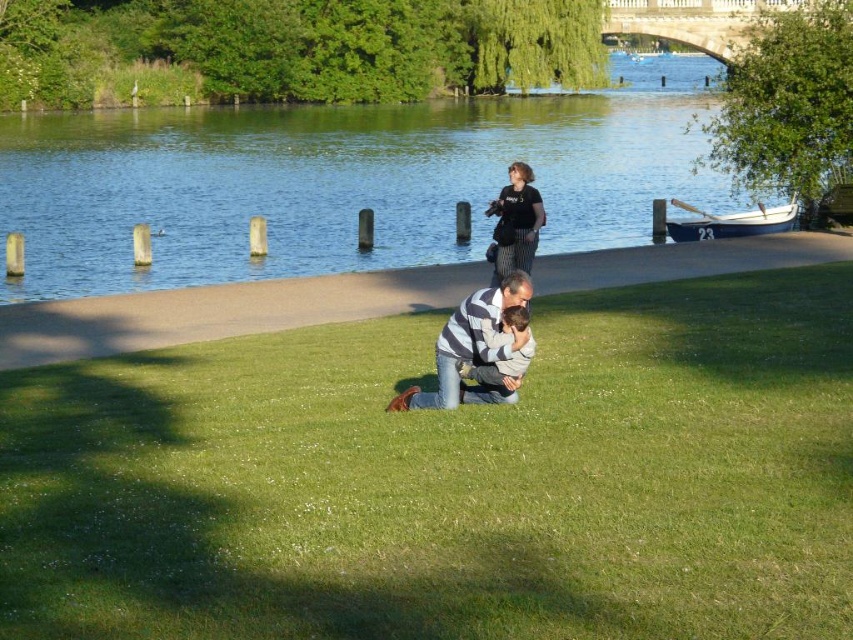
Question: Does striped knit sweater at center appear under striped fabric man at center?

Choices:
 (A) no
 (B) yes

Answer: (A)

Question: Based on their relative distances, which object is nearer to the striped fabric man at center?

Choices:
 (A) striped knit sweater at center
 (B) green grass at center
 (C) green water at upper center

Answer: (A)

Question: Does green grass at center appear on the left side of black cotton shirt at center?

Choices:
 (A) no
 (B) yes

Answer: (B)

Question: Does striped knit sweater at center appear over striped fabric man at center?

Choices:
 (A) yes
 (B) no

Answer: (A)

Question: Which of the following is the closest to the observer?

Choices:
 (A) striped fabric man at center
 (B) black cotton shirt at center

Answer: (A)

Question: Which object appears farthest from the camera in this image?

Choices:
 (A) striped knit sweater at center
 (B) black cotton shirt at center
 (C) green water at upper center

Answer: (C)